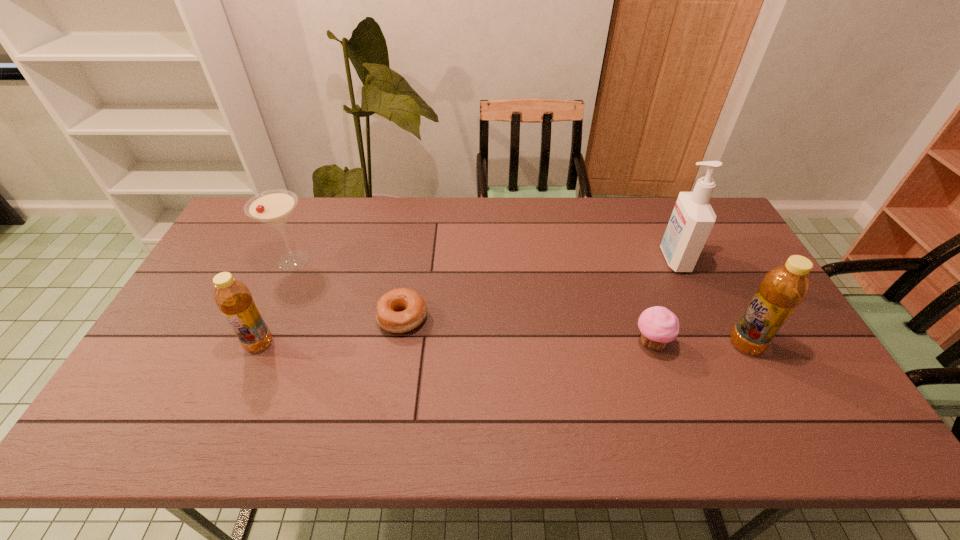
You are a GUI agent. You are given a task and a screenshot of the screen. Output one action in this format:
    pyautogui.click(x=<x>, y=<y>)
    Task: Click on the free space at the left edge of the desktop
    This screenshot has width=960, height=540.
    Given the screenshot: What is the action you would take?
    pyautogui.click(x=221, y=252)

This screenshot has width=960, height=540. In the image, there is a desktop. Identify the location of vacant region at the near right corner. (773, 381).

I want to click on free space between the second shortest object and the left bottle, so click(x=455, y=343).

I want to click on unoccupied position between the martini and the left bottle, so click(276, 302).

Locate an element on the screen. Image resolution: width=960 pixels, height=540 pixels. empty location between the shorter bottle and the cleansing agent is located at coordinates (467, 301).

Where is `free space between the left bottle and the second tallest object`? Image resolution: width=960 pixels, height=540 pixels. free space between the left bottle and the second tallest object is located at coordinates (502, 344).

At what (x,y) coordinates should I click in order to perform the action: click on vacant space that is in between the martini and the cupcake. Please return your answer as a coordinate pair (x, y). Image resolution: width=960 pixels, height=540 pixels. Looking at the image, I should click on (472, 302).

You are a GUI agent. You are given a task and a screenshot of the screen. Output one action in this format:
    pyautogui.click(x=<x>, y=<y>)
    Task: Click on the vacant space that's between the left bottle and the fourth object from left to right
    The width and height of the screenshot is (960, 540).
    Given the screenshot: What is the action you would take?
    pyautogui.click(x=455, y=343)

You are a GUI agent. You are given a task and a screenshot of the screen. Output one action in this format:
    pyautogui.click(x=<x>, y=<y>)
    Task: Click on the empty space that is in between the third object from left to right and the martini
    The height and width of the screenshot is (540, 960).
    Given the screenshot: What is the action you would take?
    pyautogui.click(x=348, y=289)

Where is `empty space between the fourth object from right to left and the left bottle`? The image size is (960, 540). empty space between the fourth object from right to left and the left bottle is located at coordinates (331, 331).